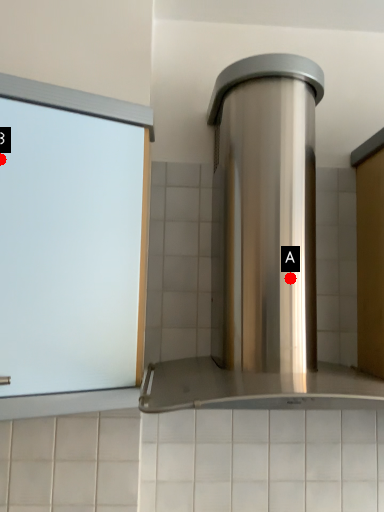
Question: Two points are circled on the image, labeled by A and B beside each circle. Which point is farther from the camera taking this photo?

Choices:
 (A) A is further
 (B) B is further

Answer: (A)